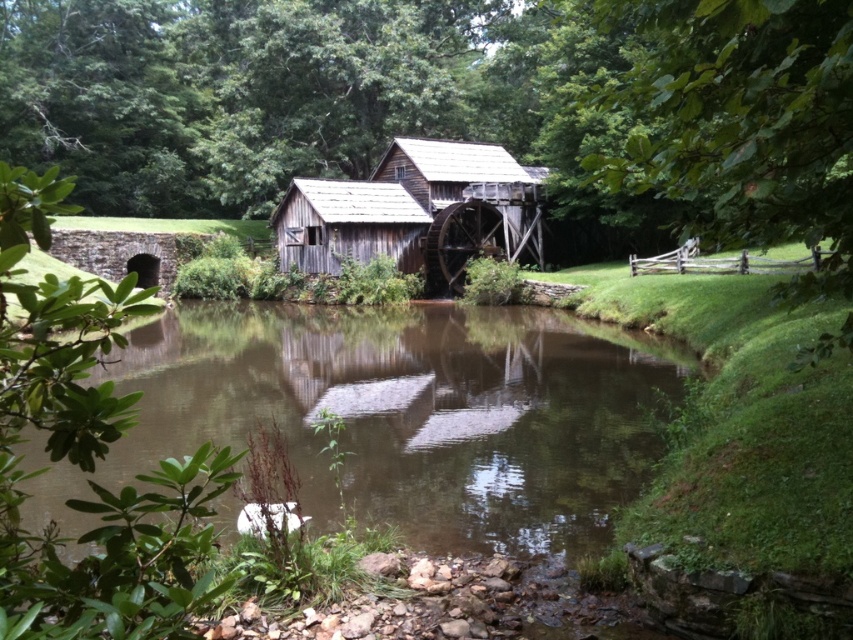
Is point (173, 410) closer to viewer compared to point (361, 198)?

That is True.

Locate an element on the screen. The height and width of the screenshot is (640, 853). brown reflective water at center is located at coordinates (402, 416).

Consider the image. Does green leafy tree at right have a greater width compared to weathered wood barn at center?

No, green leafy tree at right is not wider than weathered wood barn at center.

Between green leafy tree at right and weathered wood barn at center, which one appears on the right side from the viewer's perspective?

From the viewer's perspective, green leafy tree at right appears more on the right side.

Who is more distant from viewer, (x=782, y=163) or (x=344, y=186)?

Positioned behind is point (x=344, y=186).

Find the location of `green leafy tree at right`. green leafy tree at right is located at coordinates (740, 122).

Does brown reflective water at center appear on the left side of green leafy tree at right?

Indeed, brown reflective water at center is positioned on the left side of green leafy tree at right.

Is brown reflective water at center positioned before green leafy tree at right?

No, brown reflective water at center is behind green leafy tree at right.

Which is behind, point (354, 428) or point (837, 346)?

The point (354, 428) is more distant.

Find the location of `brown reflective water at center`. brown reflective water at center is located at coordinates (402, 416).